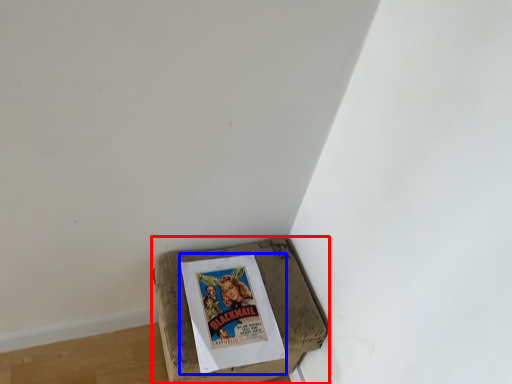
Question: Which of the following is the closest to the observer, furniture (highlighted by a red box) or comic book (highlighted by a blue box)?

Choices:
 (A) furniture
 (B) comic book

Answer: (A)